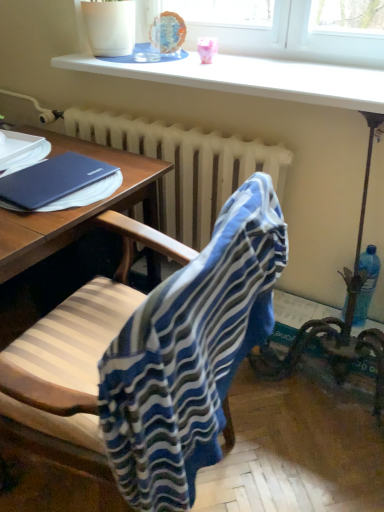
Question: Considering the relative sizes of blue plastic bottle at right and white radiator at center in the image provided, is blue plastic bottle at right bigger than white radiator at center?

Choices:
 (A) no
 (B) yes

Answer: (A)

Question: Is blue plastic bottle at right further to the viewer compared to white radiator at center?

Choices:
 (A) yes
 (B) no

Answer: (A)

Question: Is blue plastic bottle at right beside white radiator at center?

Choices:
 (A) no
 (B) yes

Answer: (A)

Question: Is blue plastic bottle at right wider than white radiator at center?

Choices:
 (A) no
 (B) yes

Answer: (A)

Question: Could you tell me if blue plastic bottle at right is turned towards white radiator at center?

Choices:
 (A) yes
 (B) no

Answer: (B)

Question: Is blue plastic bottle at right taller than white radiator at center?

Choices:
 (A) yes
 (B) no

Answer: (B)

Question: Considering the relative sizes of matte blue notebook at left and blue striped fabric at center in the image provided, is matte blue notebook at left thinner than blue striped fabric at center?

Choices:
 (A) yes
 (B) no

Answer: (A)

Question: Is matte blue notebook at left aimed at blue striped fabric at center?

Choices:
 (A) yes
 (B) no

Answer: (B)

Question: Is matte blue notebook at left in contact with blue striped fabric at center?

Choices:
 (A) no
 (B) yes

Answer: (A)

Question: From a real-world perspective, is matte blue notebook at left over blue striped fabric at center?

Choices:
 (A) no
 (B) yes

Answer: (B)

Question: Is matte blue notebook at left wider than blue striped fabric at center?

Choices:
 (A) yes
 (B) no

Answer: (B)

Question: Is matte blue notebook at left to the left of blue striped fabric at center from the viewer's perspective?

Choices:
 (A) yes
 (B) no

Answer: (A)

Question: Is blue plastic bottle at right placed right next to blue striped fabric at center?

Choices:
 (A) no
 (B) yes

Answer: (A)